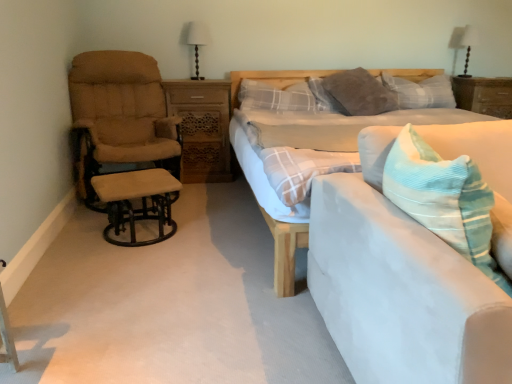
Locate an element on the screen. free space in front of beige fabric stool at left is located at coordinates (123, 268).